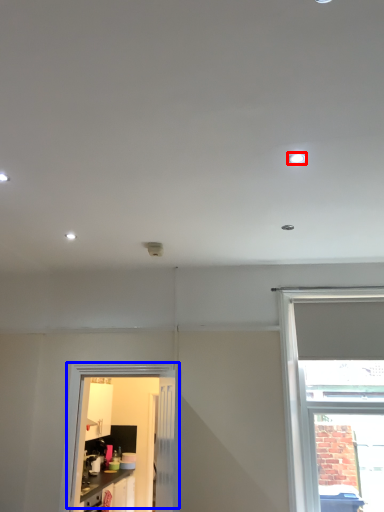
Question: Which object is further to the camera taking this photo, lighting (highlighted by a red box) or door (highlighted by a blue box)?

Choices:
 (A) lighting
 (B) door

Answer: (B)